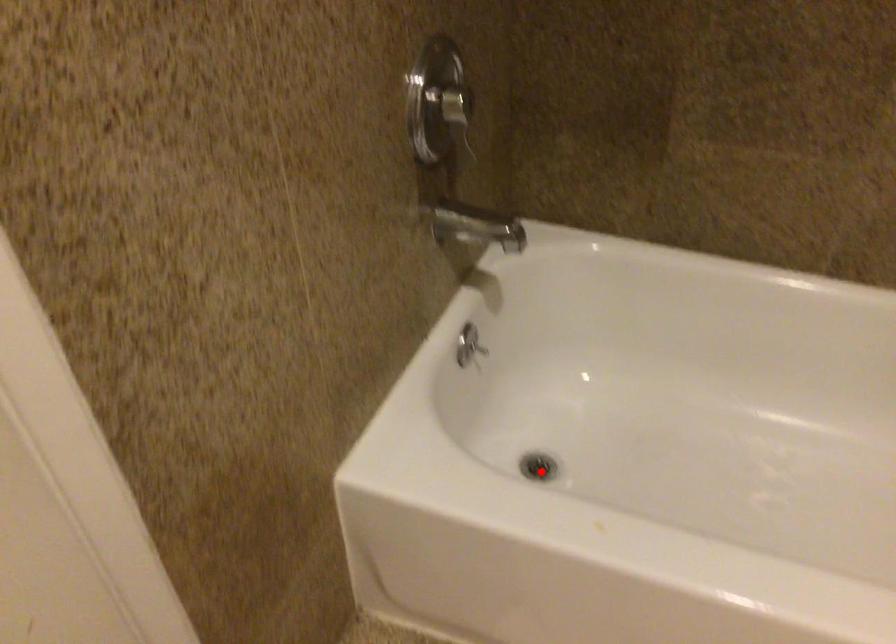
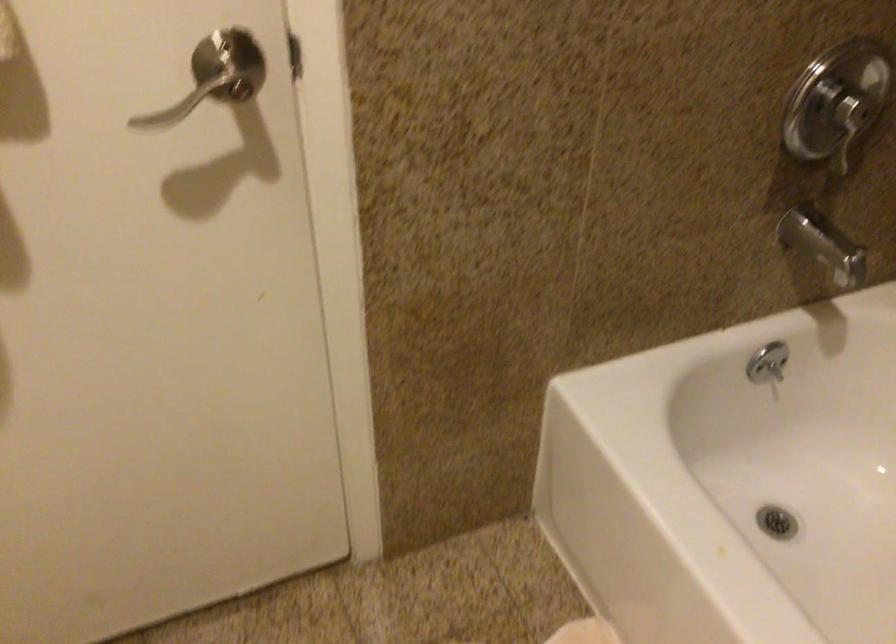
Locate, in the second image, the point that corresponds to the highlighted location in the first image.

(776, 522)